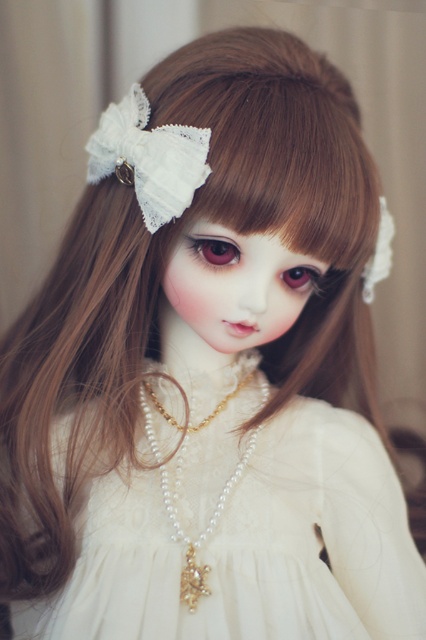
You are a photographer trying to capture the doll in the image. You notice two points marked in the scene. The first point is at coordinate point [356,548] and the second is at point [123,163]. To ensure proper depth of field, you need to focus on the point that is closer to the camera. Which point should you choose?

Point [123,163] is closer to the camera than point [356,548], so you should focus on point [123,163] to ensure proper depth of field.